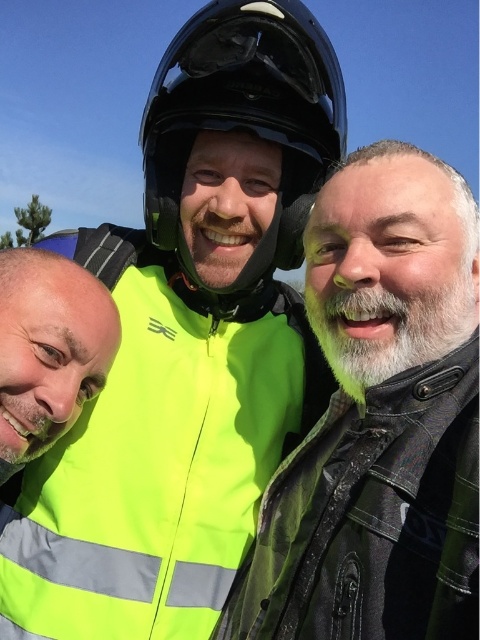
Question: Which object is closer to the camera taking this photo?

Choices:
 (A) neon yellow reflective vest at center
 (B) glossy black helmet at center

Answer: (A)

Question: Does neon yellow reflective vest at center have a smaller size compared to neon yellow vest at left?

Choices:
 (A) yes
 (B) no

Answer: (B)

Question: Does neon yellow reflective vest at center have a smaller size compared to glossy black helmet at center?

Choices:
 (A) no
 (B) yes

Answer: (A)

Question: Does neon yellow jacket at center have a smaller size compared to glossy black helmet at center?

Choices:
 (A) no
 (B) yes

Answer: (A)

Question: Which object appears closest to the camera in this image?

Choices:
 (A) glossy black helmet at center
 (B) neon yellow vest at left
 (C) neon yellow reflective vest at center
 (D) neon yellow jacket at center

Answer: (D)

Question: Which is nearer to the glossy black helmet at center?

Choices:
 (A) neon yellow jacket at center
 (B) neon yellow reflective vest at center

Answer: (B)